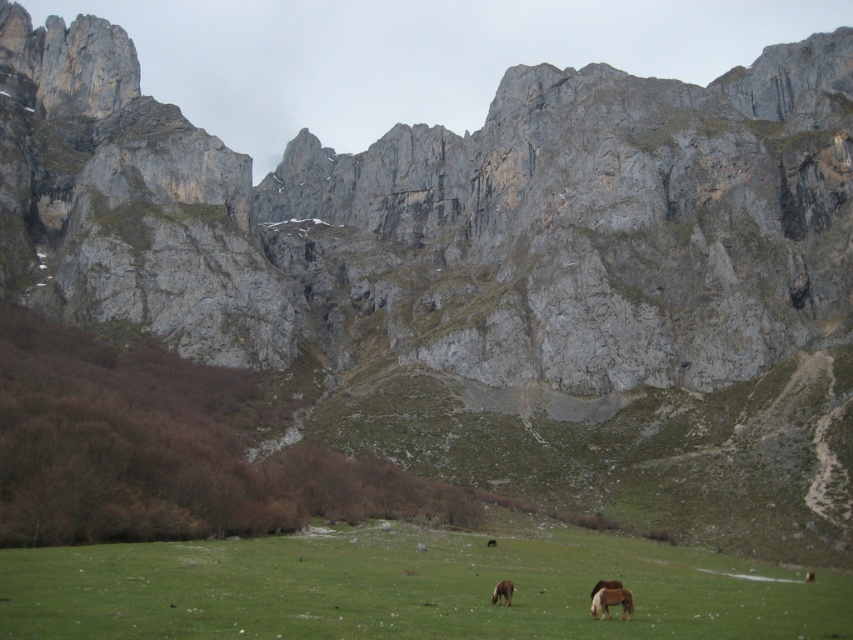
Question: Can you confirm if green grass pasture at lower center is bigger than brown matte horse at center?

Choices:
 (A) yes
 (B) no

Answer: (A)

Question: Which point is farther from the camera taking this photo?

Choices:
 (A) (810, 636)
 (B) (608, 588)

Answer: (B)

Question: Can you confirm if brown matte horse at center is positioned above brown matte horse at lower center?

Choices:
 (A) yes
 (B) no

Answer: (A)

Question: Which of the following is the farthest from the observer?

Choices:
 (A) (503, 595)
 (B) (476, 604)

Answer: (B)

Question: Considering the relative positions of green grass pasture at lower center and brown matte horse at center in the image provided, where is green grass pasture at lower center located with respect to brown matte horse at center?

Choices:
 (A) right
 (B) left

Answer: (B)

Question: Estimate the real-world distances between objects in this image. Which object is farther from the brown matte horse at center?

Choices:
 (A) brown fuzzy horse at lower center
 (B) green grass pasture at lower center

Answer: (B)